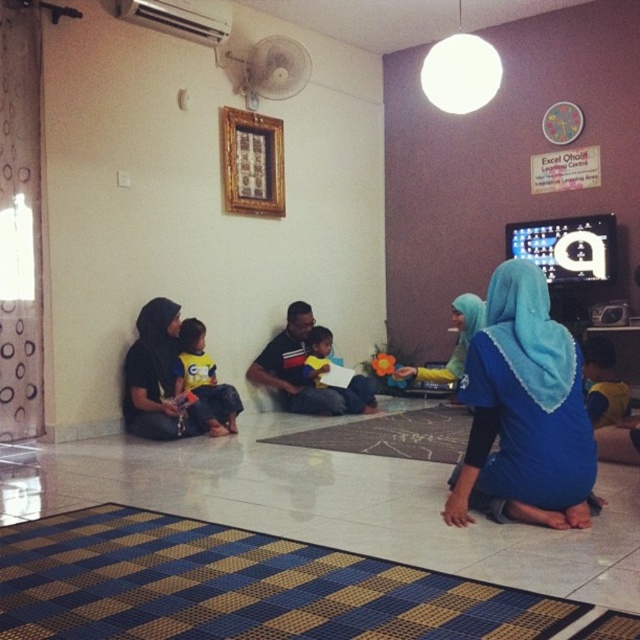
Question: Does blue fabric hijab at center appear over yellow fabric shirt at center?

Choices:
 (A) yes
 (B) no

Answer: (A)

Question: In this image, where is blue fabric hijab at center located relative to matte black hijab at left?

Choices:
 (A) right
 (B) left

Answer: (A)

Question: Which point is farther from the camera taking this photo?

Choices:
 (A) (282, 368)
 (B) (273, 564)

Answer: (A)

Question: Can you confirm if blue woven mat at lower center is bigger than white textured mat at center?

Choices:
 (A) no
 (B) yes

Answer: (A)

Question: Which object is the closest to the yellow fabric shirt at center?

Choices:
 (A) dark blue shirt at center
 (B) blue fabric hijab at center
 (C) blue fabric dress at center

Answer: (A)

Question: Based on their relative distances, which object is nearer to the yellow jersey at left?

Choices:
 (A) dark blue shirt at center
 (B) matte black hijab at left
 (C) blue fabric dress at center
 (D) yellow fabric shirt at center

Answer: (B)